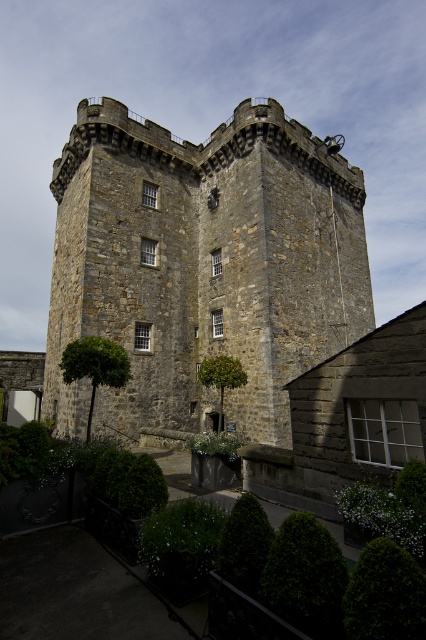
Does green leafy tree at lower left appear under green leafy tree at center?

Incorrect, green leafy tree at lower left is not positioned below green leafy tree at center.

Locate an element on the screen. The width and height of the screenshot is (426, 640). green leafy tree at lower left is located at coordinates (94, 365).

Does rustic stone castle at center appear on the left side of green leafy tree at center?

Indeed, rustic stone castle at center is positioned on the left side of green leafy tree at center.

Does rustic stone castle at center have a greater height compared to green leafy tree at center?

Yes, rustic stone castle at center is taller than green leafy tree at center.

Measure the distance between rustic stone castle at center and camera.

A distance of 150.15 feet exists between rustic stone castle at center and camera.

In order to click on rustic stone castle at center in this screenshot , I will do `click(201, 266)`.

Is point (52, 268) in front of point (106, 371)?

No, it is not.

Can you confirm if rustic stone castle at center is positioned to the left of green leafy tree at lower left?

No, rustic stone castle at center is not to the left of green leafy tree at lower left.

Find the location of `rustic stone castle at center`. rustic stone castle at center is located at coordinates (201, 266).